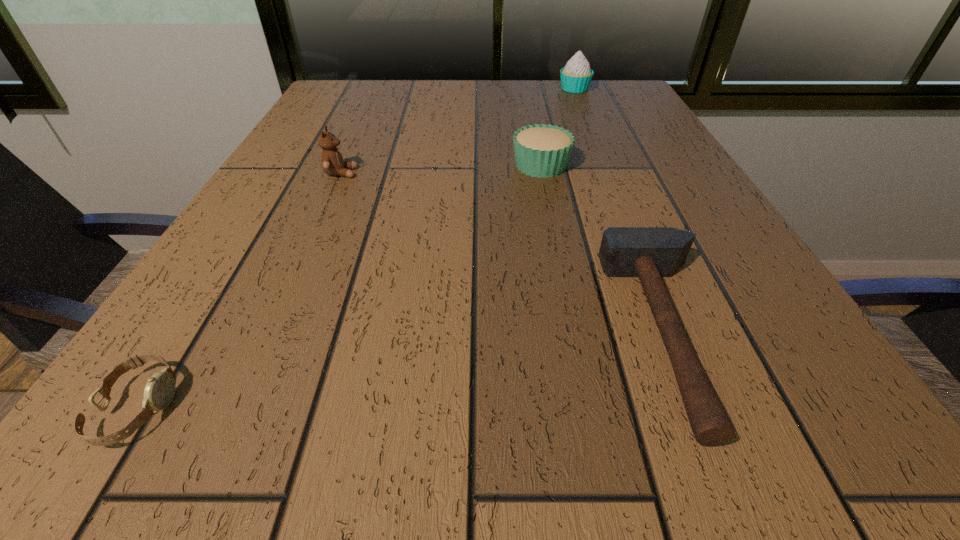
This screenshot has height=540, width=960. In order to click on vacant point located between the fourth object from right to left and the leftmost object in this screenshot , I will do `click(240, 290)`.

Find the location of a particular element. vacant space in between the right cupcake and the hammer is located at coordinates (622, 211).

Where is `vacant region between the right cupcake and the hammer`? vacant region between the right cupcake and the hammer is located at coordinates (622, 211).

Locate an element on the screen. The height and width of the screenshot is (540, 960). free space that is in between the watch and the shorter cupcake is located at coordinates (340, 286).

This screenshot has width=960, height=540. In order to click on vacant space that is in between the farther cupcake and the shortest object in this screenshot , I will do `click(356, 248)`.

The image size is (960, 540). Find the location of `object that is the fourth nearest to the shorter cupcake`. object that is the fourth nearest to the shorter cupcake is located at coordinates (159, 391).

Image resolution: width=960 pixels, height=540 pixels. I want to click on the third closest object to the left cupcake, so click(x=576, y=76).

Where is `vacant space that satisfies the following two spatial constraints: 1. on the front side of the shorter cupcake; 2. on the face of the shortest object`? Image resolution: width=960 pixels, height=540 pixels. vacant space that satisfies the following two spatial constraints: 1. on the front side of the shorter cupcake; 2. on the face of the shortest object is located at coordinates (590, 407).